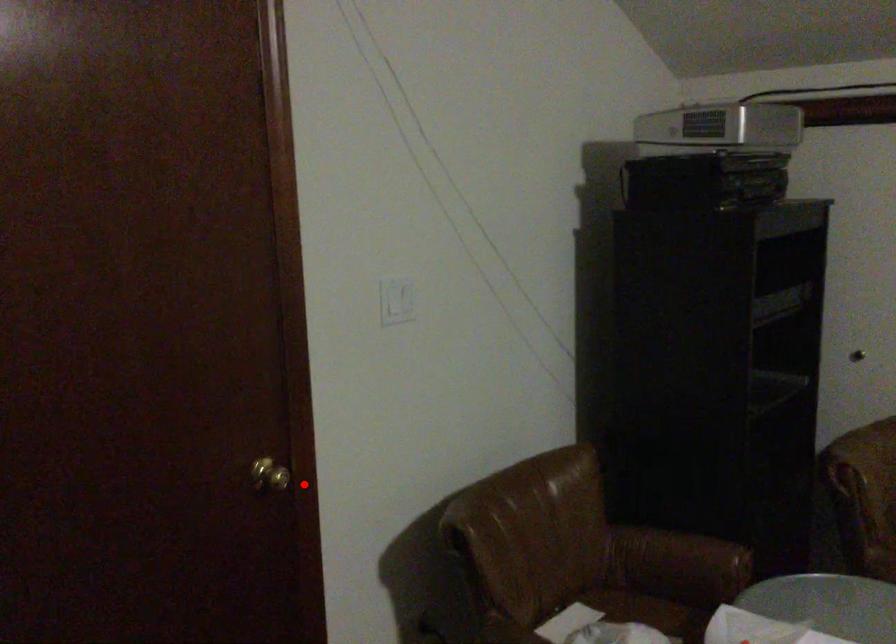
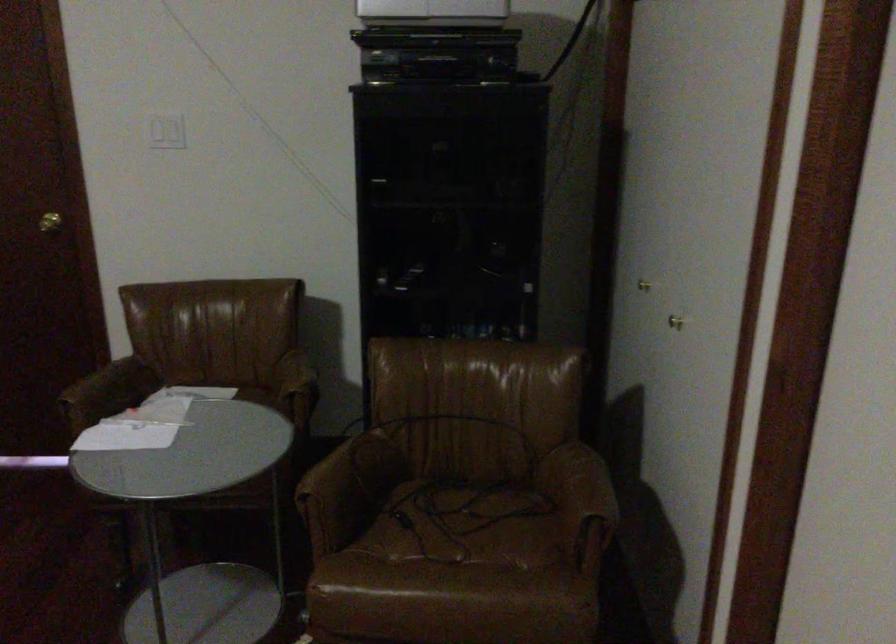
Question: I am providing you with two images of the same scene from different viewpoints. In image1, a red point is highlighted. Considering the same 3D point in image2, which of the following is correct?

Choices:
 (A) It is closer
 (B) It is farther

Answer: (B)